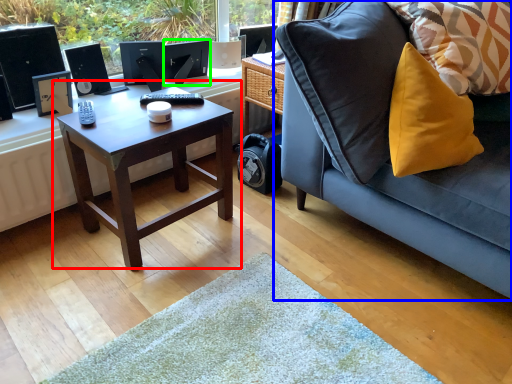
Question: Which is farther away from coffee table (highlighted by a red box)? studio couch (highlighted by a blue box) or computer monitor (highlighted by a green box)?

Choices:
 (A) studio couch
 (B) computer monitor

Answer: (B)